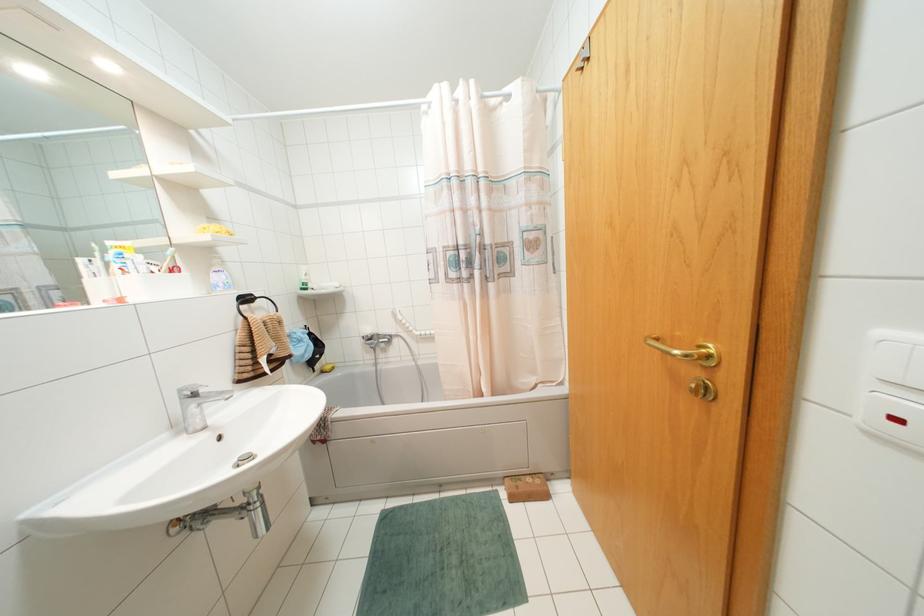
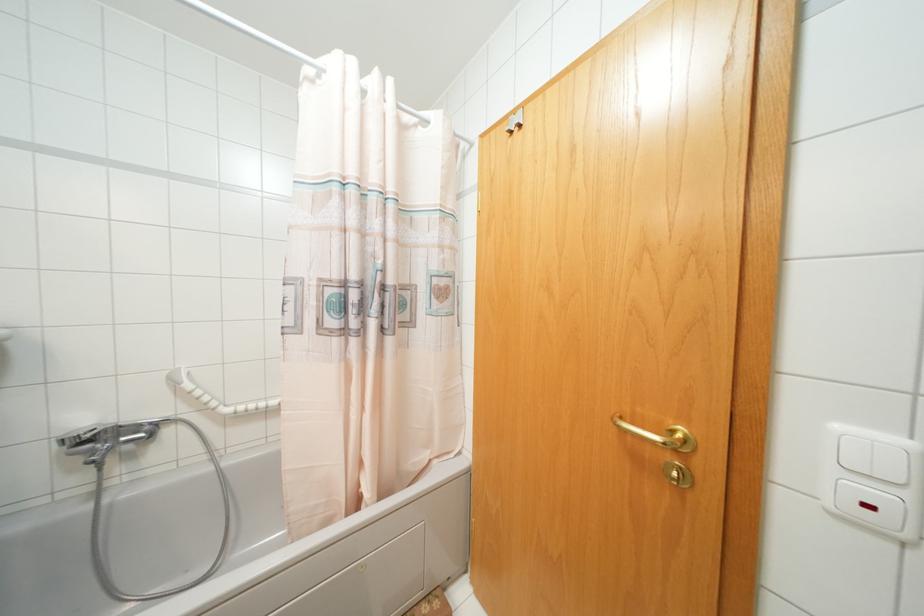
Locate, in the second image, the point that corresponds to point (580, 68) in the first image.

(511, 132)